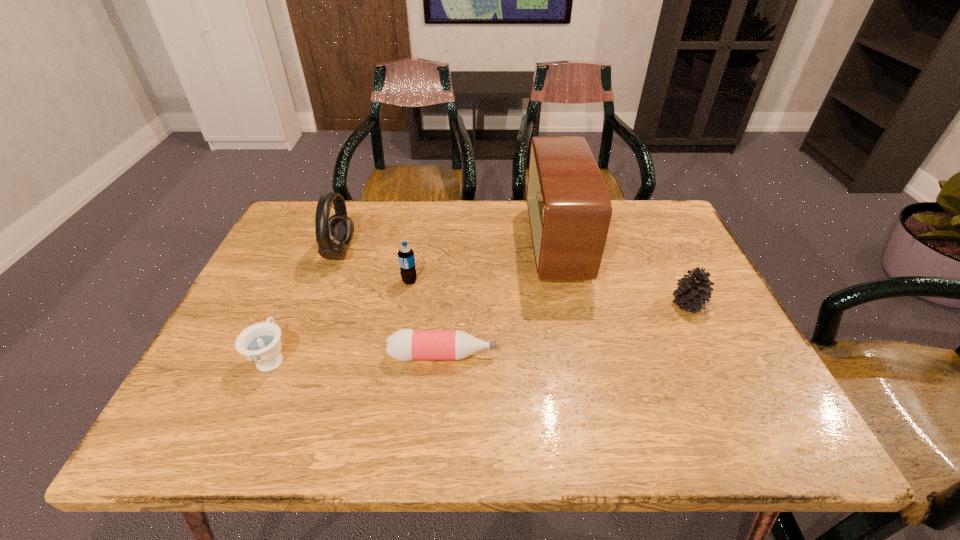
I want to click on vacant area located 0.360m on the front-facing side of the radio receiver, so click(x=403, y=244).

Locate an element on the screen. This screenshot has height=540, width=960. vacant space situated on the earcups of the headset is located at coordinates (461, 252).

Locate an element on the screen. The width and height of the screenshot is (960, 540). vacant space located on the front of the soda bottle is located at coordinates (392, 383).

You are a GUI agent. You are given a task and a screenshot of the screen. Output one action in this format:
    pyautogui.click(x=<x>, y=<y>)
    Task: Click on the vacant space situated on the front of the pinecone
    
    Given the screenshot: What is the action you would take?
    pyautogui.click(x=716, y=361)

The image size is (960, 540). I want to click on vacant space located 0.170m on the side of the teacup with the handle, so click(303, 285).

The width and height of the screenshot is (960, 540). Find the location of `free location located on the side of the teacup with the handle`. free location located on the side of the teacup with the handle is located at coordinates (321, 246).

The height and width of the screenshot is (540, 960). I want to click on free space located on the side of the teacup with the handle, so click(x=323, y=240).

Locate an element on the screen. The image size is (960, 540). vacant space located with the cap open on the bottle is located at coordinates (658, 355).

Find the location of a particular element. This screenshot has width=960, height=540. radio receiver present at the far edge is located at coordinates (569, 208).

Find the location of `headset that is at the far edge`. headset that is at the far edge is located at coordinates (333, 234).